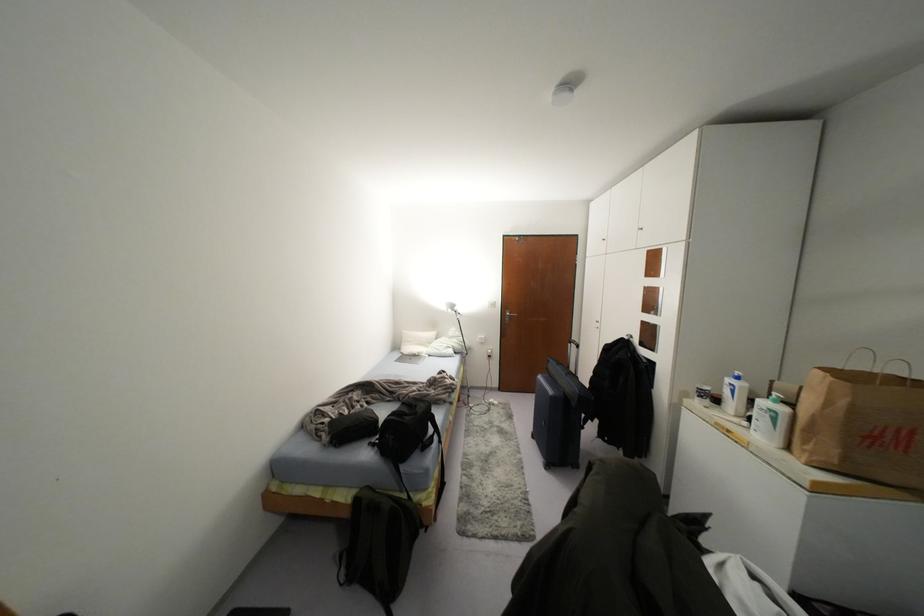
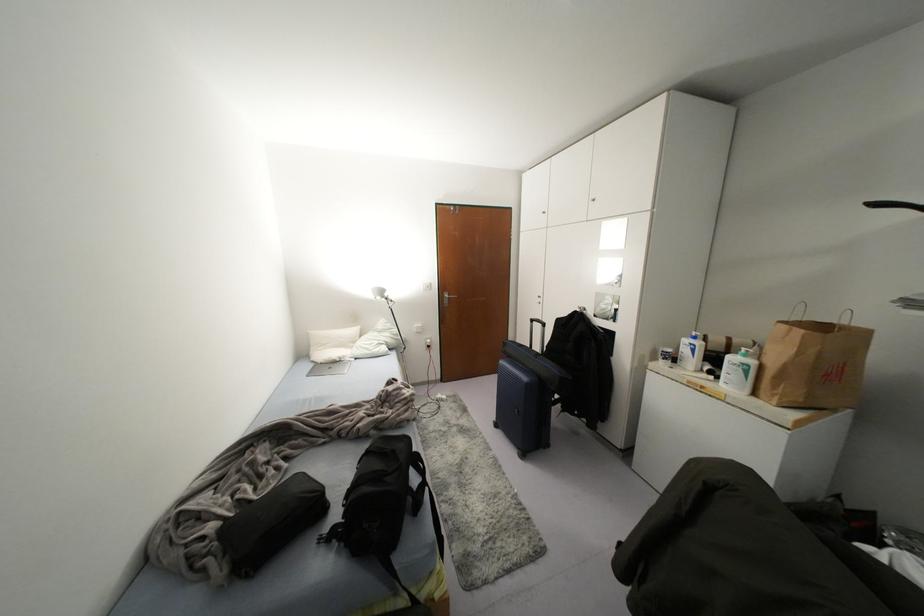
In the second image, find the point that corresponds to point (455, 308) in the first image.

(385, 294)